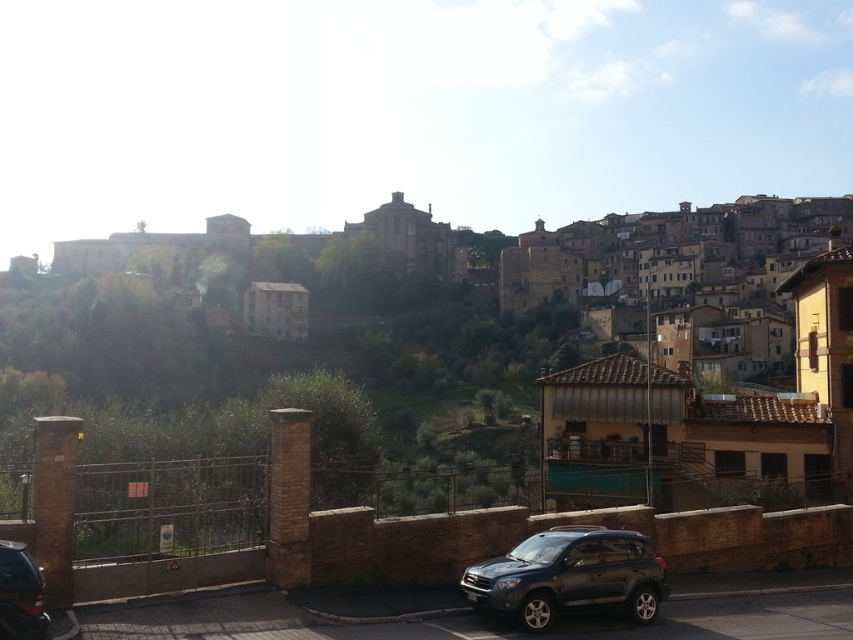
Is satin dark gray suv at lower center positioned behind shiny black car at lower left?

Yes, satin dark gray suv at lower center is behind shiny black car at lower left.

Which is below, satin dark gray suv at lower center or shiny black car at lower left?

satin dark gray suv at lower center is lower down.

Is point (654, 566) positioned after point (39, 612)?

Yes, it is behind point (39, 612).

You are a GUI agent. You are given a task and a screenshot of the screen. Output one action in this format:
    pyautogui.click(x=<x>, y=<y>)
    Task: Click on the satin dark gray suv at lower center
    The height and width of the screenshot is (640, 853).
    Given the screenshot: What is the action you would take?
    pyautogui.click(x=569, y=576)